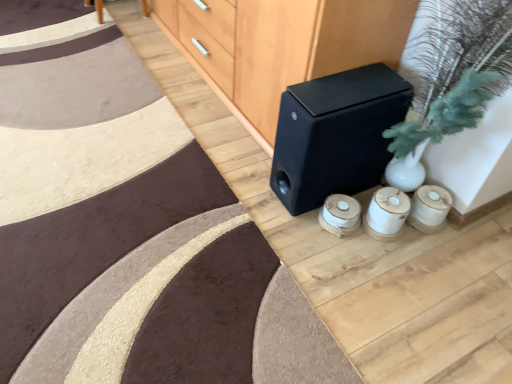
Measure the distance between black matte speaker at center and camera.

black matte speaker at center and camera are 3.96 feet apart.

I want to click on black matte speaker at center, so click(297, 47).

This screenshot has height=384, width=512. What do you see at coordinates (297, 47) in the screenshot?
I see `black matte speaker at center` at bounding box center [297, 47].

Describe the element at coordinates (336, 134) in the screenshot. Image resolution: width=512 pixels, height=384 pixels. I see `black matte speaker at center` at that location.

The height and width of the screenshot is (384, 512). Find the location of `black matte speaker at center`. black matte speaker at center is located at coordinates (336, 134).

Where is `black matte speaker at center`? The width and height of the screenshot is (512, 384). black matte speaker at center is located at coordinates (297, 47).

Which is more to the right, black matte speaker at center or black matte speaker at center?

From the viewer's perspective, black matte speaker at center appears more on the right side.

Which is in front, black matte speaker at center or black matte speaker at center?

black matte speaker at center is closer to the camera.

Does point (239, 102) appear closer or farther from the camera than point (328, 101)?

Point (239, 102) appears to be farther away from the viewer than point (328, 101).

From the image's perspective, which is above, black matte speaker at center or black matte speaker at center?

From the image's view, black matte speaker at center is above.

From a real-world perspective, is black matte speaker at center located higher than black matte speaker at center?

Yes.

In terms of width, does black matte speaker at center look wider or thinner when compared to black matte speaker at center?

black matte speaker at center is wider than black matte speaker at center.

Considering the relative sizes of black matte speaker at center and black matte speaker at center in the image provided, is black matte speaker at center taller than black matte speaker at center?

Correct, black matte speaker at center is much taller as black matte speaker at center.

Looking at the image, does black matte speaker at center seem bigger or smaller compared to black matte speaker at center?

In the image, black matte speaker at center appears to be larger than black matte speaker at center.

Is black matte speaker at center inside black matte speaker at center?

No, black matte speaker at center is not inside black matte speaker at center.

Is black matte speaker at center not close to black matte speaker at center?

No, black matte speaker at center is not far from black matte speaker at center.

Does black matte speaker at center turn towards black matte speaker at center?

No, black matte speaker at center is not oriented towards black matte speaker at center.

What's the angular difference between black matte speaker at center and black matte speaker at center's facing directions?

There is a 1.18-degree angle between the facing directions of black matte speaker at center and black matte speaker at center.

This screenshot has width=512, height=384. I want to click on furniture that appears on the left of black matte speaker at center, so pyautogui.click(x=297, y=47).

Which is more to the left, black matte speaker at center or black matte speaker at center?

black matte speaker at center is more to the left.

Is the depth of black matte speaker at center greater than that of black matte speaker at center?

Yes.

Is point (389, 100) closer or farther from the camera than point (244, 76)?

Point (389, 100).

From the image's perspective, who appears lower, black matte speaker at center or black matte speaker at center?

black matte speaker at center, from the image's perspective.

From a real-world perspective, which object stands above the other?

black matte speaker at center is physically above.

Considering the sizes of objects black matte speaker at center and black matte speaker at center in the image provided, who is wider, black matte speaker at center or black matte speaker at center?

With larger width is black matte speaker at center.

Is black matte speaker at center taller or shorter than black matte speaker at center?

Clearly, black matte speaker at center is shorter compared to black matte speaker at center.

Between black matte speaker at center and black matte speaker at center, which one has larger size?

With larger size is black matte speaker at center.

Is black matte speaker at center completely or partially outside of black matte speaker at center?

Yes, black matte speaker at center is not within black matte speaker at center.

Is there a large distance between black matte speaker at center and black matte speaker at center?

black matte speaker at center is actually quite close to black matte speaker at center.

Is black matte speaker at center positioned with its back to black matte speaker at center?

No, black matte speaker at center is not at the back of black matte speaker at center.

What's the angular difference between black matte speaker at center and black matte speaker at center's facing directions?

1.18 degrees.

I want to click on furniture above the black matte speaker at center (from a real-world perspective), so click(297, 47).

Where is `speaker behind the black matte speaker at center`? This screenshot has height=384, width=512. speaker behind the black matte speaker at center is located at coordinates (336, 134).

This screenshot has height=384, width=512. In order to click on furniture above the black matte speaker at center (from the image's perspective) in this screenshot , I will do coord(297,47).